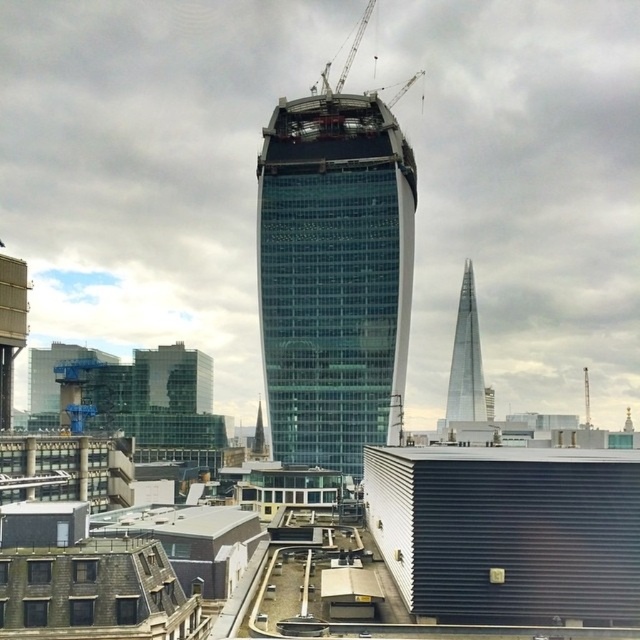
Question: Which of the following is the closest to the observer?

Choices:
 (A) transparent glass tower at right
 (B) transparent glass skyscraper at center

Answer: (B)

Question: Considering the relative positions of transparent glass tower at right and metallic construction crane at upper center in the image provided, where is transparent glass tower at right located with respect to metallic construction crane at upper center?

Choices:
 (A) right
 (B) left

Answer: (A)

Question: Which of the following is the farthest from the observer?

Choices:
 (A) (474, 294)
 (B) (321, 86)
 (C) (403, 362)

Answer: (A)

Question: In this image, where is transparent glass tower at right located relative to metallic construction crane at upper center?

Choices:
 (A) right
 (B) left

Answer: (A)

Question: Which point is closer to the camera?

Choices:
 (A) (324, 67)
 (B) (275, 294)
 (C) (460, 358)

Answer: (B)

Question: Is transparent glass tower at right positioned in front of metallic construction crane at upper center?

Choices:
 (A) no
 (B) yes

Answer: (A)